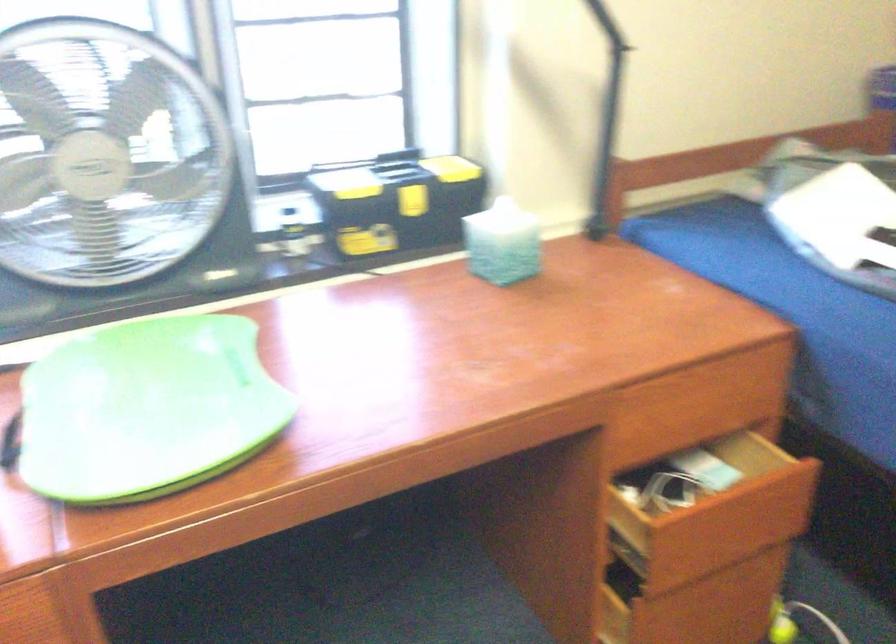
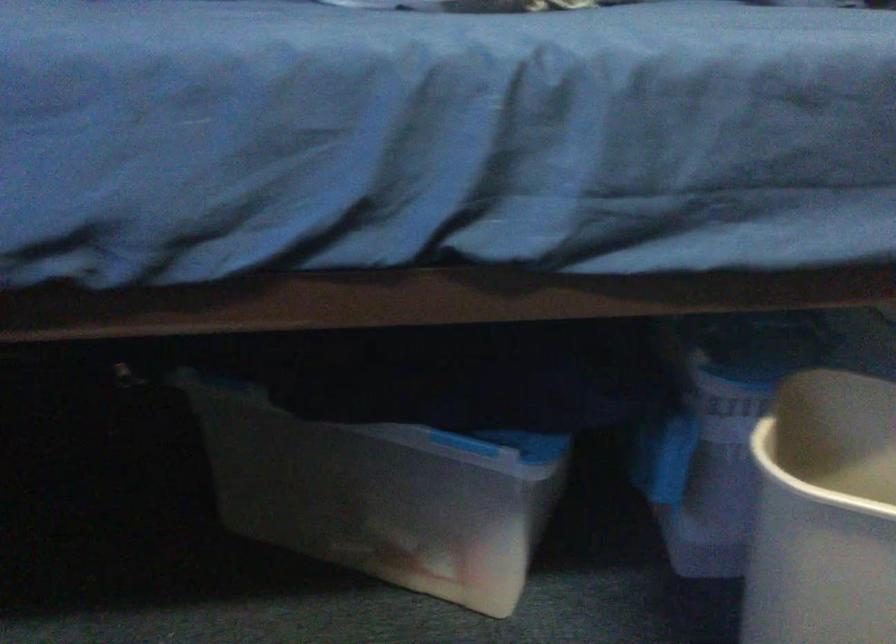
Question: The camera is either moving clockwise (left) or counter-clockwise (right) around the object. The first image is from the beginning of the video and the second image is from the end. Is the camera moving left or right when shooting the video?

Choices:
 (A) Left
 (B) Right

Answer: (A)